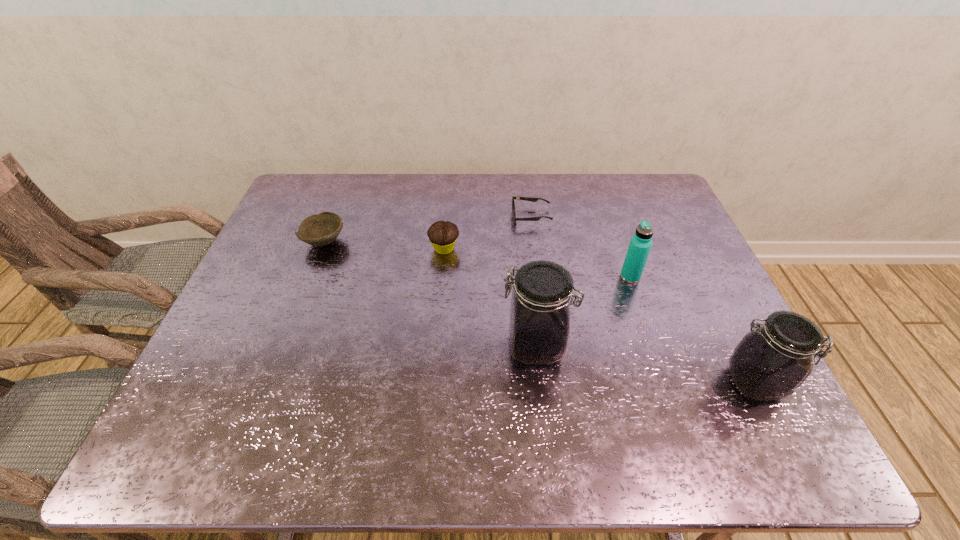
The width and height of the screenshot is (960, 540). Find the location of `vacant space at the far left corner of the desktop`. vacant space at the far left corner of the desktop is located at coordinates (313, 189).

This screenshot has width=960, height=540. In order to click on empty location between the leftmost object and the left jar in this screenshot , I will do click(x=429, y=294).

Locate an element on the screen. The width and height of the screenshot is (960, 540). empty location between the tallest object and the rightmost object is located at coordinates (645, 364).

Find the location of `free spot between the fifth object from left to right and the shorter jar`. free spot between the fifth object from left to right and the shorter jar is located at coordinates (692, 329).

Identify the location of vacant region between the water bottle and the rightmost object. (692, 329).

Find the location of `empty space between the rightmost object and the shortest object`. empty space between the rightmost object and the shortest object is located at coordinates (643, 299).

At what (x,y) coordinates should I click in order to perform the action: click on blank region between the leftmost object and the tallest object. Please return your answer as a coordinate pair (x, y). This screenshot has height=540, width=960. Looking at the image, I should click on (429, 294).

Identify the location of vacant space that's between the fifth object from left to right and the right jar. The width and height of the screenshot is (960, 540). (692, 329).

You are a GUI agent. You are given a task and a screenshot of the screen. Output one action in this format:
    pyautogui.click(x=<x>, y=<y>)
    Task: Click on the free spot between the third nearest object and the farthest object
    This screenshot has width=960, height=540.
    Given the screenshot: What is the action you would take?
    pyautogui.click(x=581, y=246)

Locate an element on the screen. The width and height of the screenshot is (960, 540). object that is the second nearest to the second object from left to right is located at coordinates (320, 229).